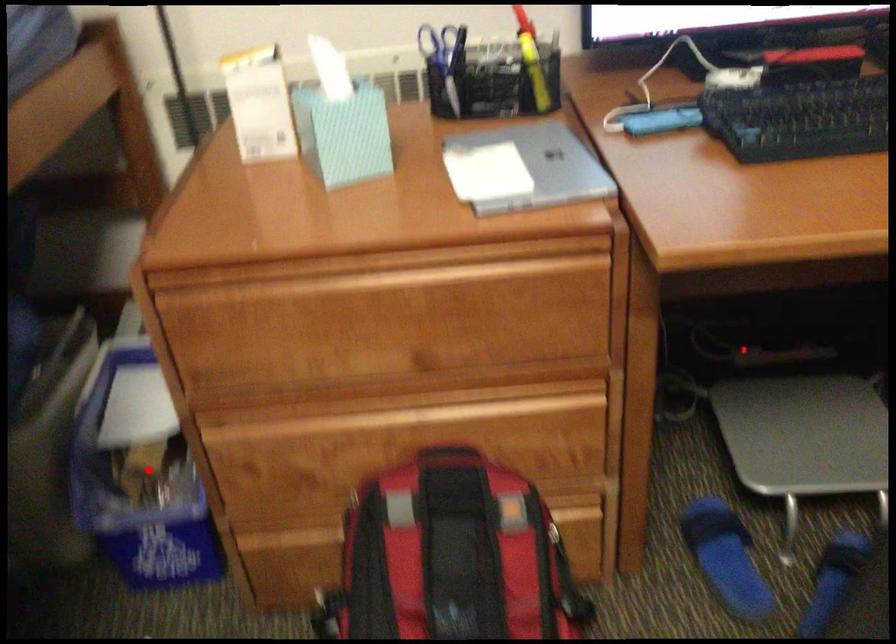
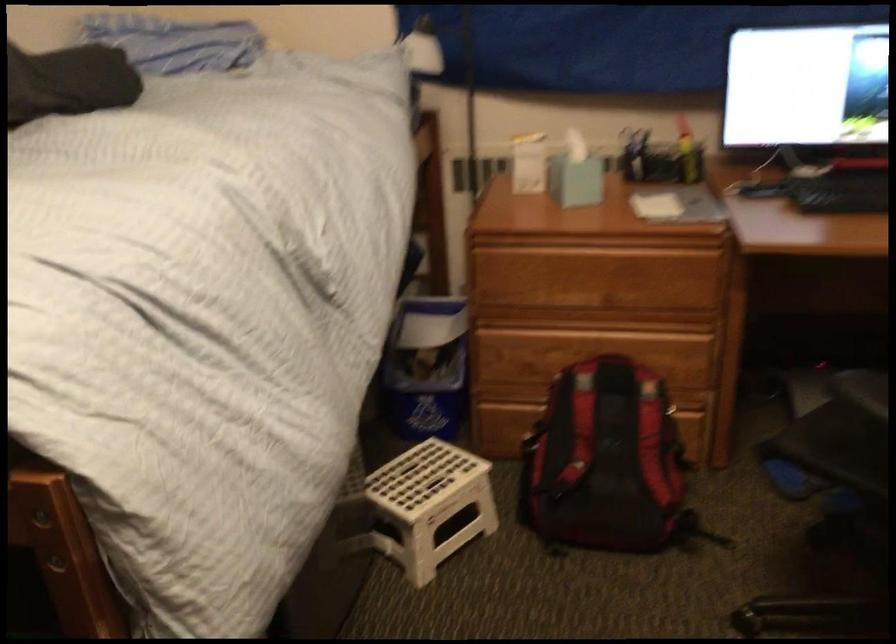
Question: I am providing you with two images of the same scene from different viewpoints. A red point is shown in image1. For the corresponding object point in image2, is it positioned nearer or farther from the camera?

Choices:
 (A) Nearer
 (B) Farther

Answer: (B)